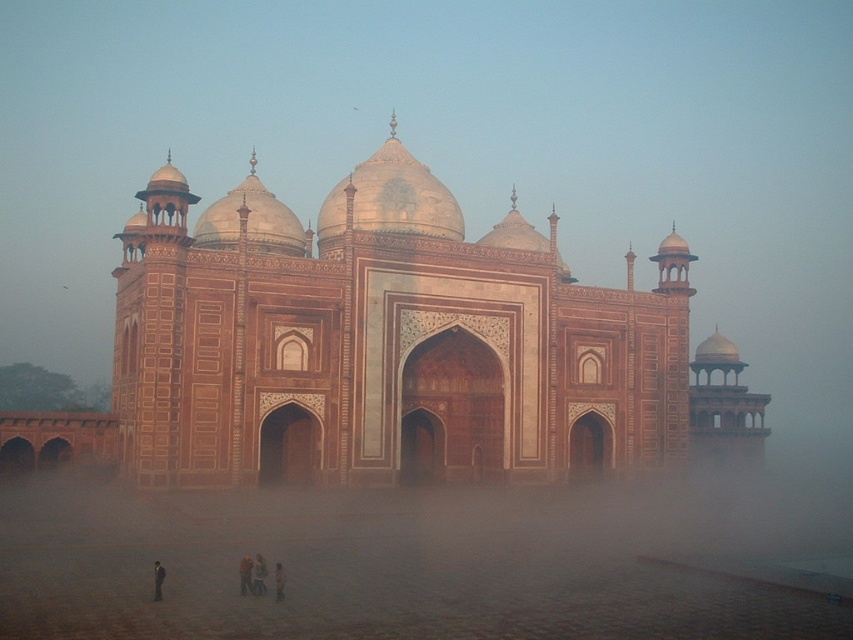
You are an architect planning to add a decorative element to the scene. The marble palace at center and the light brown fabric pants at lower center are both in view. Which object should you choose to place a wide decorative element on, considering their widths?

The marble palace at center has a greater width than the light brown fabric pants at lower center, so placing a wide decorative element on the marble palace at center would be more appropriate.

What are the coordinates of the marble palace at center in the image?

The marble palace at center is located at point (x=381, y=340).